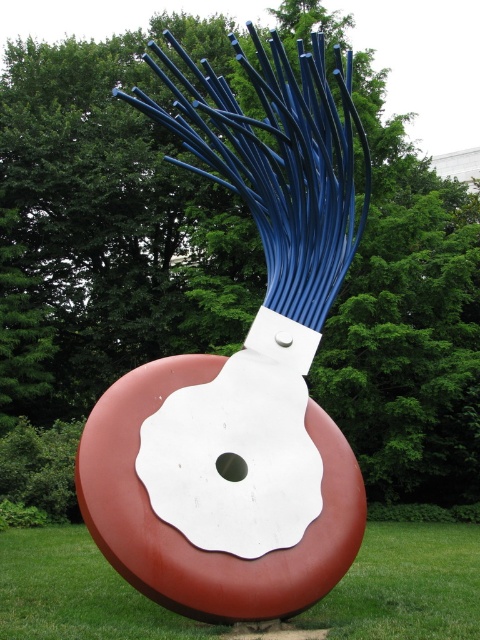
Is matte blue wire at center below green grass at lower center?

No, matte blue wire at center is not below green grass at lower center.

Can you confirm if matte blue wire at center is positioned to the right of green grass at lower center?

Yes, matte blue wire at center is to the right of green grass at lower center.

At what (x,y) coordinates should I click in order to perform the action: click on matte blue wire at center. Please return your answer as a coordinate pair (x, y). Image resolution: width=480 pixels, height=640 pixels. Looking at the image, I should click on (242, 372).